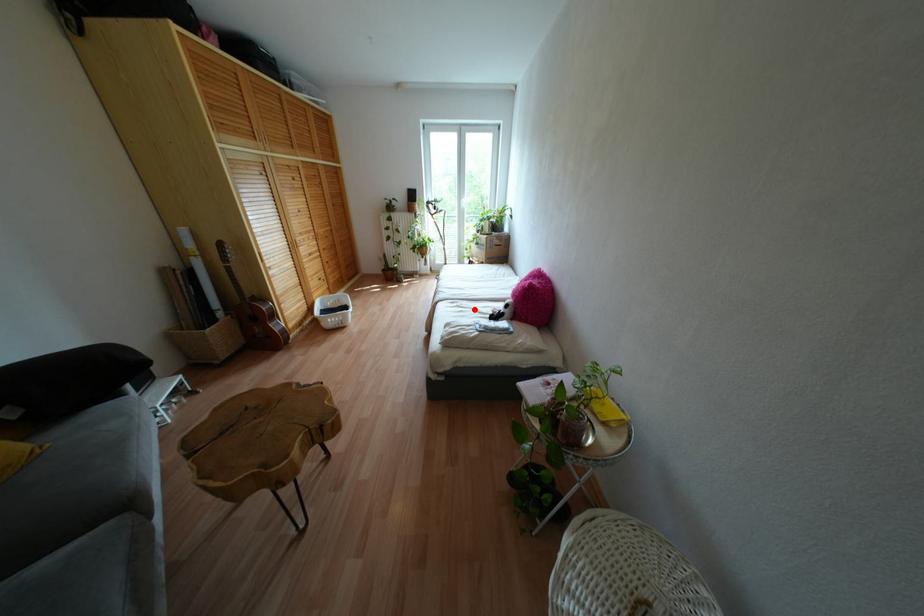
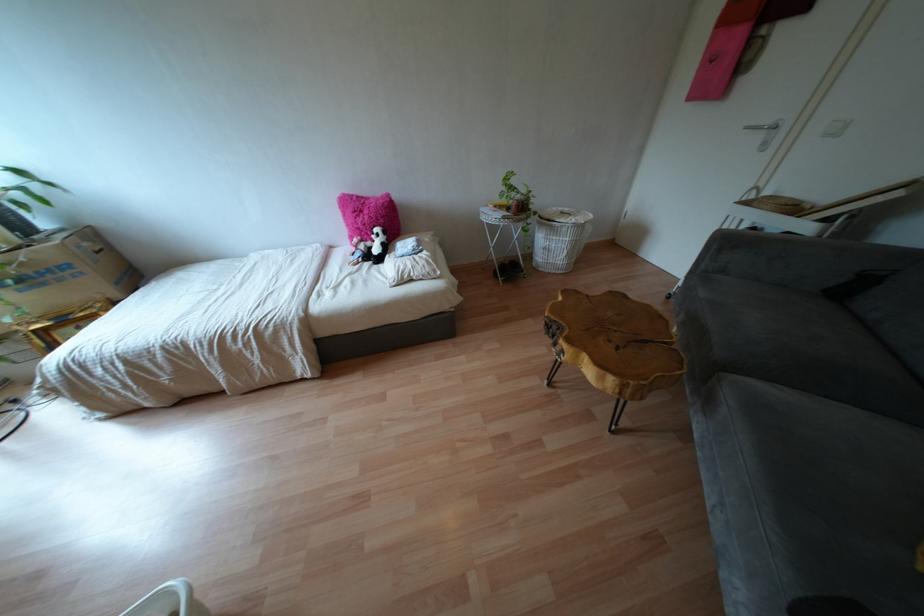
The point at the highlighted location is marked in the first image. Where is the corresponding point in the second image?

(349, 274)